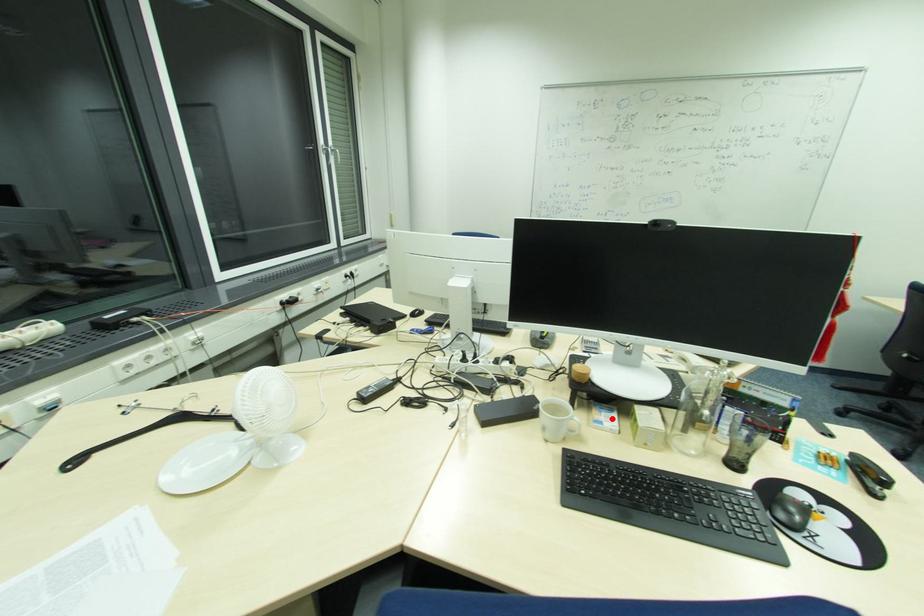
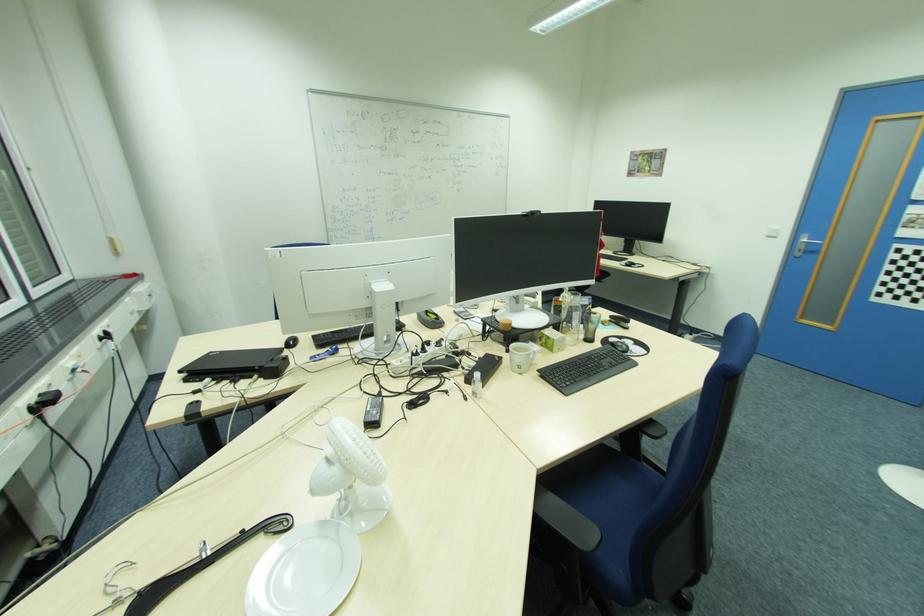
Locate, in the second image, the point that corresponds to the highlighted location in the first image.

(536, 346)